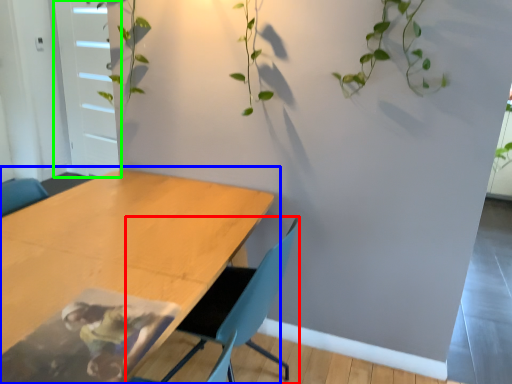
Question: Which is nearer to the chair (highlighted by a red box)? table (highlighted by a blue box) or glass door (highlighted by a green box).

Choices:
 (A) table
 (B) glass door

Answer: (A)